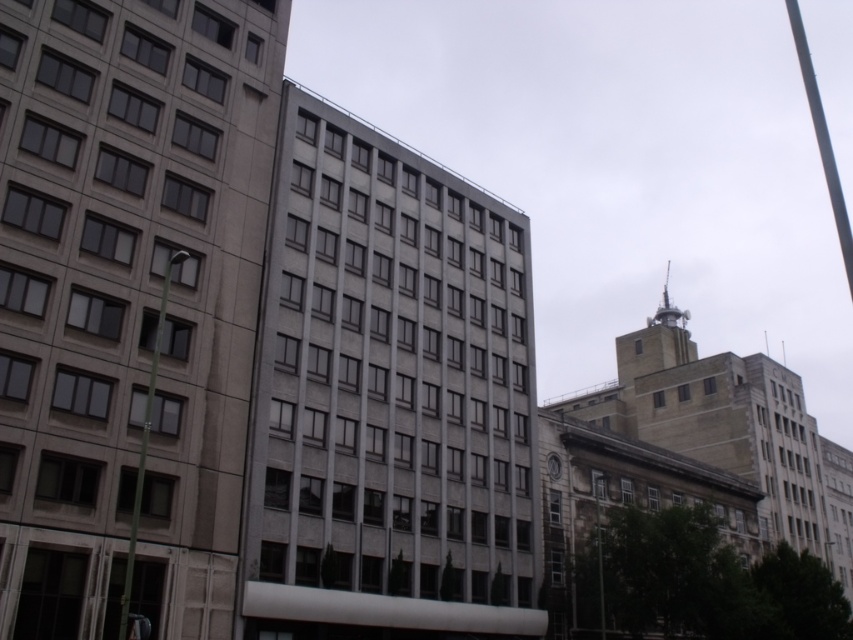
You are standing at the point with coordinates (821, 138) in the urban landscape. What object is located at this point?

The smooth gray pole at upper right is located at point (821, 138).

You are a city planner assessing the urban layout. You need to determine if the gray concrete building at center can be seen from the green metallic pole at left without any obstruction. Based on their relative positions, is there a clear line of sight between them?

The gray concrete building at center is wider than the green metallic pole at left, so there might be an obstruction. However, since the pole is positioned to the left and the building is centrally located, the pole might still have a clear view unless the building extends too far to the left. Without specific distance data, it is uncertain, but the building being wider could block the view depending on their exact placement.

From the picture: You are a city planner assessing the urban layout. You need to determine if the green metallic pole at left can be placed closer to the gray concrete building at center without obstructing the building. Based on their sizes, is this feasible?

The gray concrete building at center is larger in size than the green metallic pole at left. Since the pole is smaller, it can be placed closer to the building without causing obstruction.